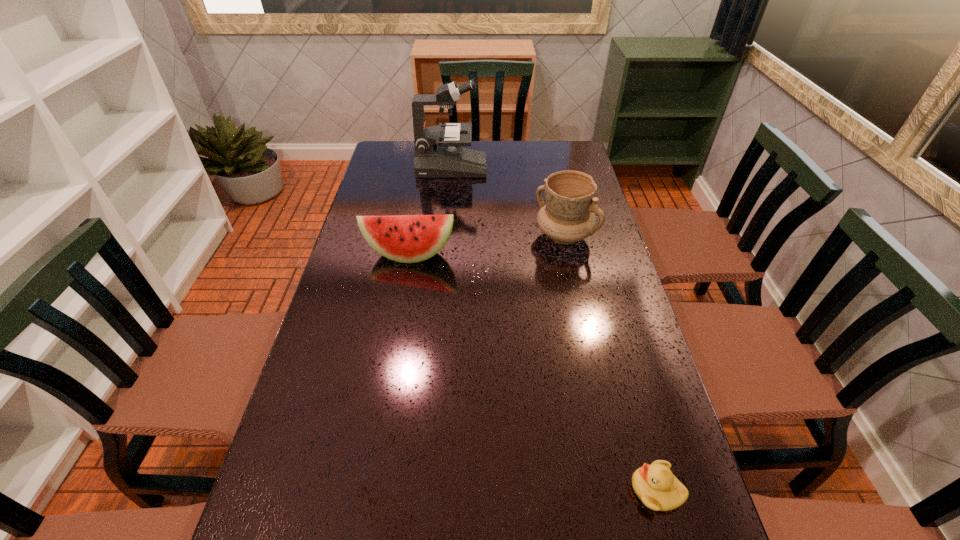
This screenshot has height=540, width=960. Find the location of `microscope`. microscope is located at coordinates (438, 149).

Image resolution: width=960 pixels, height=540 pixels. Identify the location of the farthest object. (438, 149).

Where is `the second tallest object`? This screenshot has width=960, height=540. the second tallest object is located at coordinates (568, 215).

Locate an element on the screen. watermelon is located at coordinates (403, 238).

This screenshot has width=960, height=540. What are the coordinates of `duckling` in the screenshot? It's located at (655, 485).

The image size is (960, 540). Identify the location of the nearest object. tap(655, 485).

At what (x,y) coordinates should I click in order to perform the action: click on vacant space located through the eyepieces of the farthest object. Please return your answer as a coordinate pair (x, y). The width and height of the screenshot is (960, 540). Looking at the image, I should click on (542, 167).

This screenshot has width=960, height=540. Find the location of `vacant region located on the back of the pottery`. vacant region located on the back of the pottery is located at coordinates (559, 210).

I want to click on free space located 0.100m on the outer rind of the watermelon, so click(402, 292).

The width and height of the screenshot is (960, 540). I want to click on blank space located 0.310m on the front-facing side of the shortest object, so click(x=465, y=490).